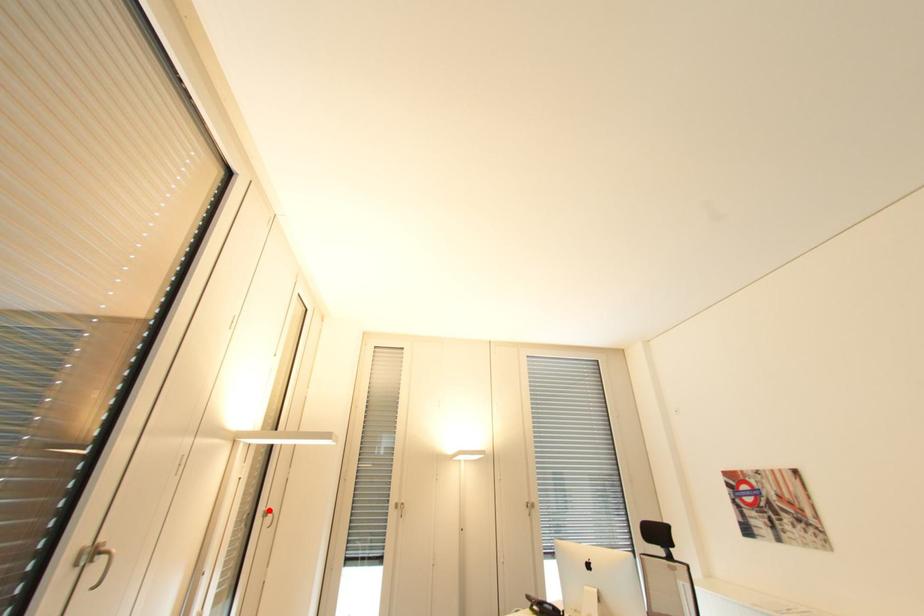
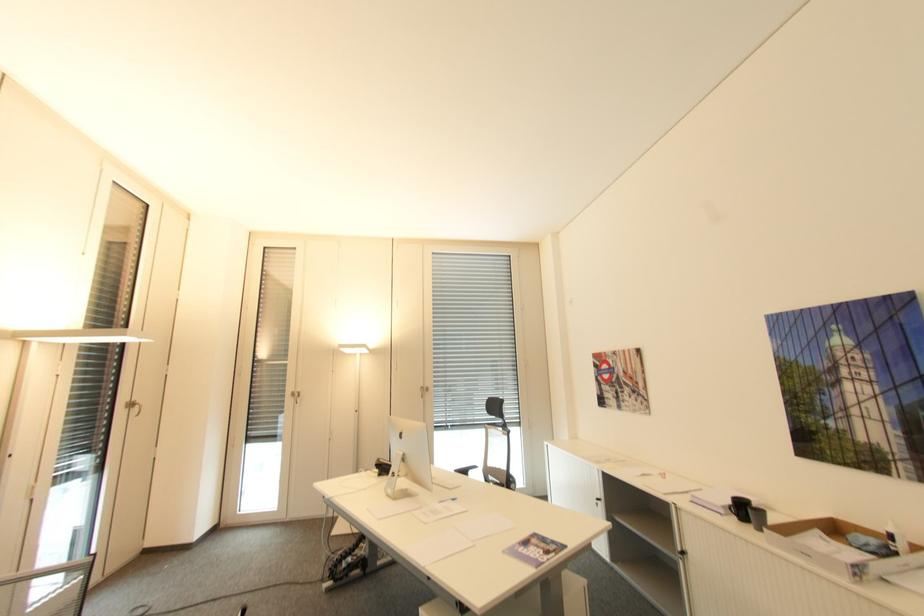
Question: I am providing you with two images of the same scene from different viewpoints. A red point is shown in image1. For the corresponding object point in image2, is it positioned nearer or farther from the camera?

Choices:
 (A) Nearer
 (B) Farther

Answer: (A)